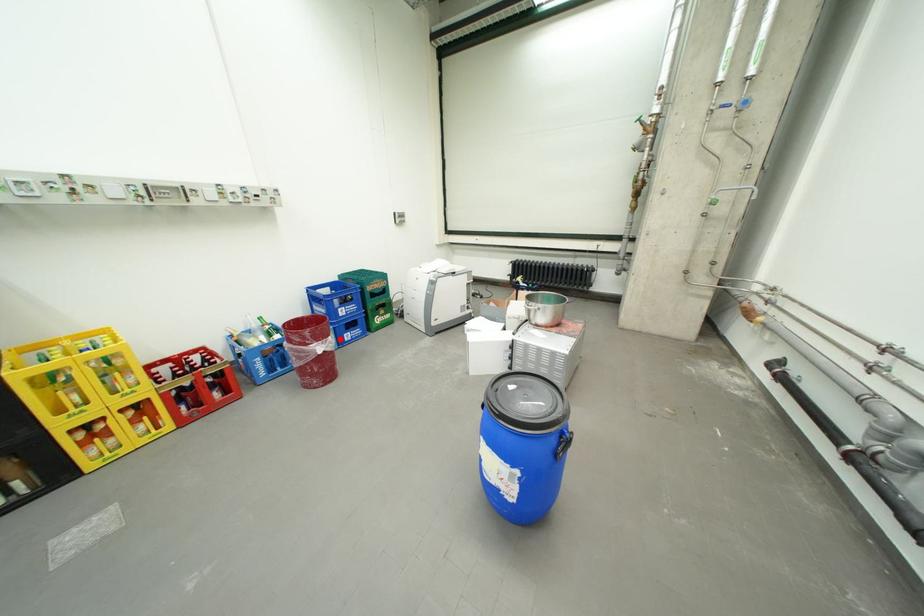
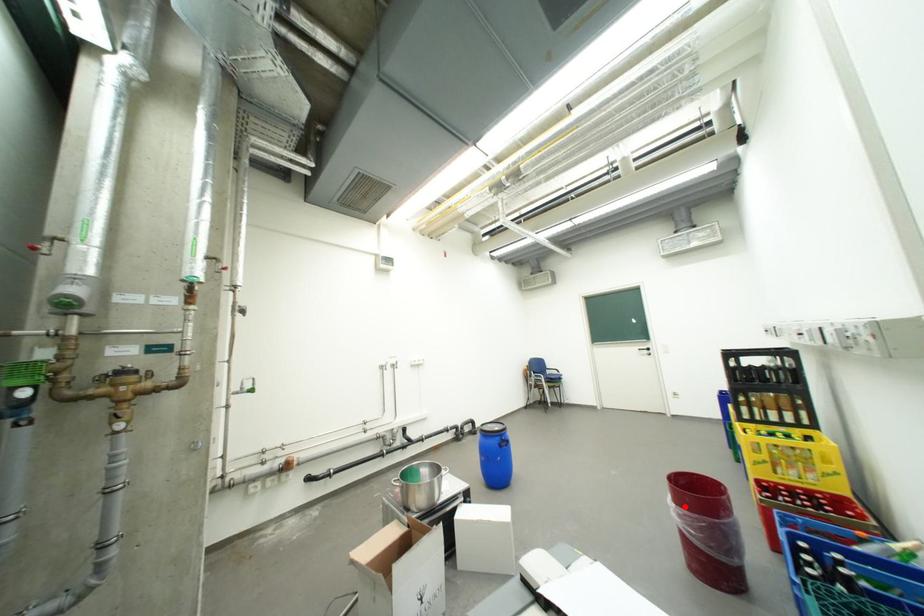
I am providing you with two images of the same scene from different viewpoints. A red point is marked on the first image and another point is marked on the second image. Does the point marked in image1 correspond to the same location as the one in image2?

Yes